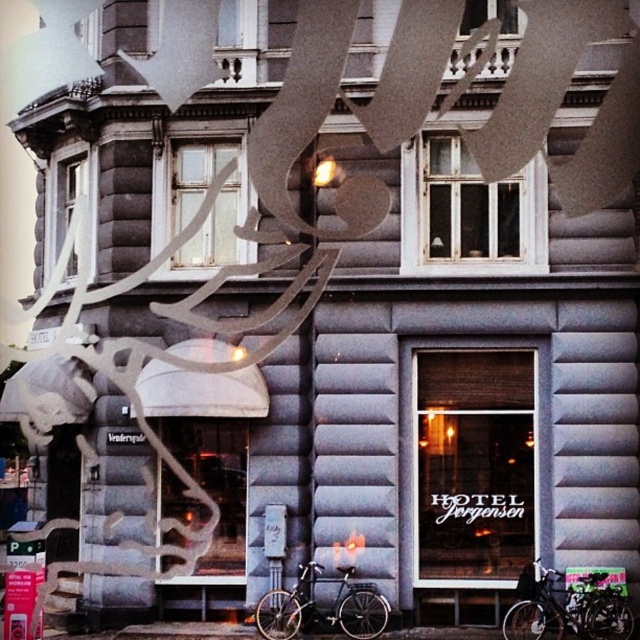
Question: Is the position of clear glass window at center less distant than that of black matte bicycle at lower right?

Choices:
 (A) no
 (B) yes

Answer: (A)

Question: Can you confirm if matte glass window at center is positioned to the right of shiny black bicycle at lower center?

Choices:
 (A) yes
 (B) no

Answer: (A)

Question: Estimate the real-world distances between objects in this image. Which object is closer to the shiny black bicycle at lower center?

Choices:
 (A) clear glass window at center
 (B) matte glass window at center
 (C) black matte bicycle at lower right
 (D) white wooden window at center

Answer: (B)

Question: Which point appears closest to the camera in this image?

Choices:
 (A) (352, 604)
 (B) (596, 625)
 (C) (467, 192)
 (D) (497, 416)

Answer: (B)

Question: Is clear glass window at center positioned behind white wooden window at center?

Choices:
 (A) yes
 (B) no

Answer: (B)

Question: Which of the following is the closest to the observer?

Choices:
 (A) clear glass window at center
 (B) shiny black bicycle at lower center

Answer: (B)